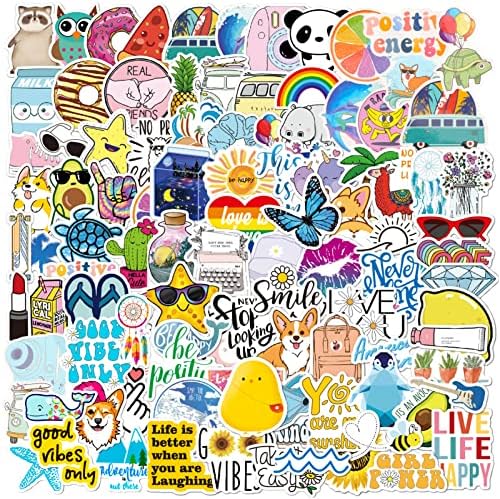
You are a GUI agent. You are given a task and a screenshot of the screen. Output one action in this format:
    pyautogui.click(x=<x>, y=<y>)
    Task: Click on the type writer
    
    Given the screenshot: What is the action you would take?
    pyautogui.click(x=232, y=264)